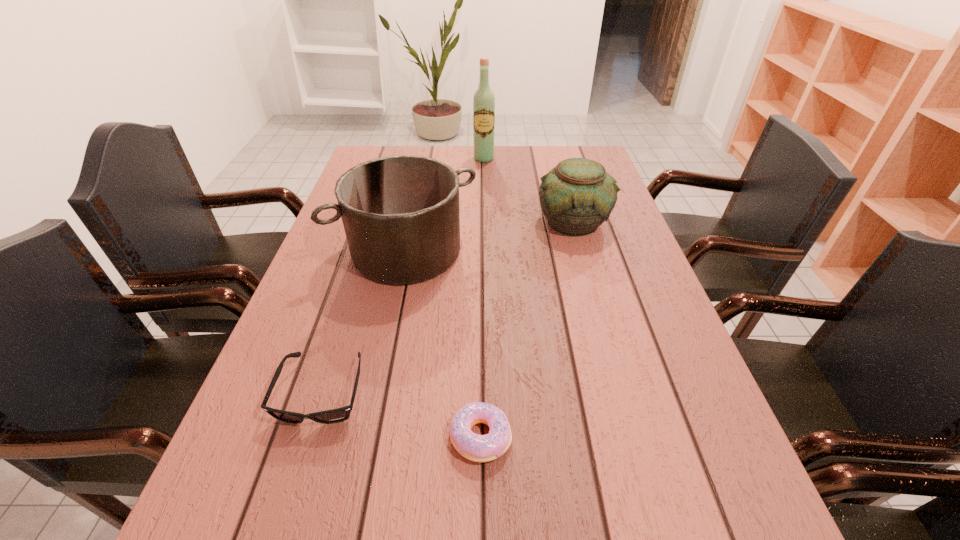
This screenshot has width=960, height=540. What are the coordinates of `free space between the second tallest object and the second shortest object` in the screenshot? It's located at (365, 322).

The image size is (960, 540). Find the location of `free space between the doughnut and the second tallest object`. free space between the doughnut and the second tallest object is located at coordinates (444, 344).

Where is `blank region between the doughnut and the second tallest object`? blank region between the doughnut and the second tallest object is located at coordinates (444, 344).

In order to click on vacant region between the doughnut and the third shortest object in this screenshot , I will do `click(527, 329)`.

This screenshot has height=540, width=960. Identify the location of unoccupied position between the pottery and the shortest object. (527, 329).

The height and width of the screenshot is (540, 960). I want to click on vacant area between the pottery and the farthest object, so click(529, 190).

You are a GUI agent. You are given a task and a screenshot of the screen. Output one action in this format:
    pyautogui.click(x=<x>, y=<y>)
    Task: Click on the free area in between the pan and the pottery
    
    Given the screenshot: What is the action you would take?
    pyautogui.click(x=491, y=237)

This screenshot has height=540, width=960. I want to click on object that is the third closest to the sunglasses, so [577, 196].

Image resolution: width=960 pixels, height=540 pixels. What are the coordinates of `object identified as the second closest to the wine bottle` in the screenshot? It's located at (400, 213).

Where is `free space that satisfies the following two spatial constraints: 1. on the back side of the second tallest object; 2. on the right side of the pottery`? free space that satisfies the following two spatial constraints: 1. on the back side of the second tallest object; 2. on the right side of the pottery is located at coordinates (413, 221).